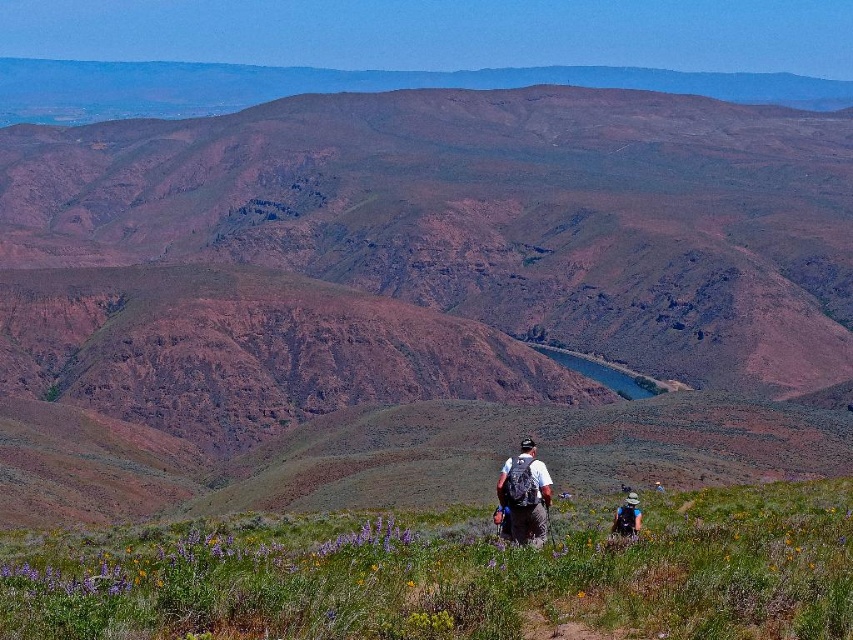
Question: Is brown rocky mountain at center below matte black backpack at center?

Choices:
 (A) yes
 (B) no

Answer: (B)

Question: Which of these objects is positioned farthest from the matte black backpack at center?

Choices:
 (A) brown rocky mountain at center
 (B) matte gray backpack at lower center

Answer: (A)

Question: Which of the following is the farthest from the observer?

Choices:
 (A) brown rocky mountain at center
 (B) matte gray backpack at lower center
 (C) matte black backpack at center

Answer: (A)

Question: Does matte black backpack at center come behind matte gray backpack at lower center?

Choices:
 (A) no
 (B) yes

Answer: (A)

Question: Does matte black backpack at center appear over matte gray backpack at lower center?

Choices:
 (A) yes
 (B) no

Answer: (A)

Question: Which point is farther to the camera?

Choices:
 (A) (699, 156)
 (B) (508, 461)

Answer: (A)